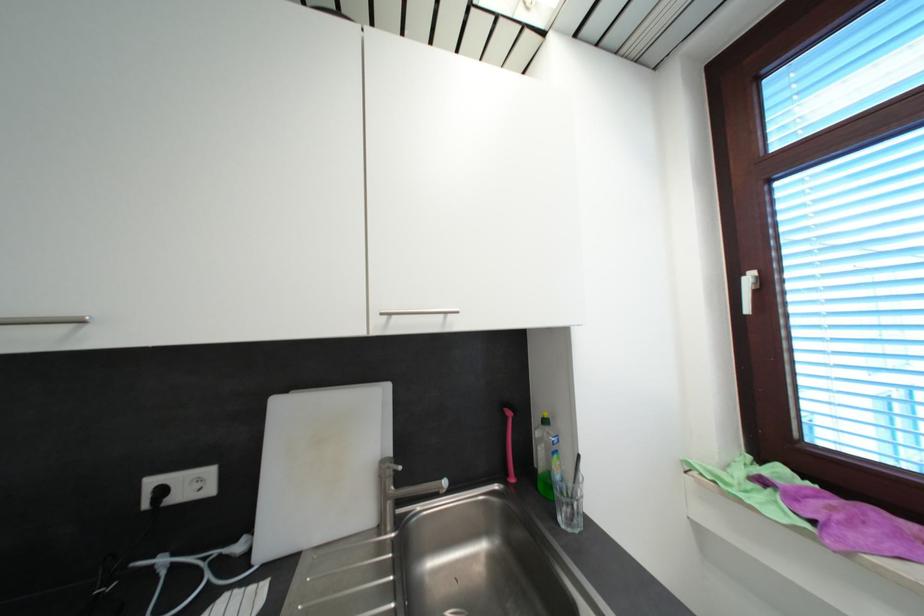
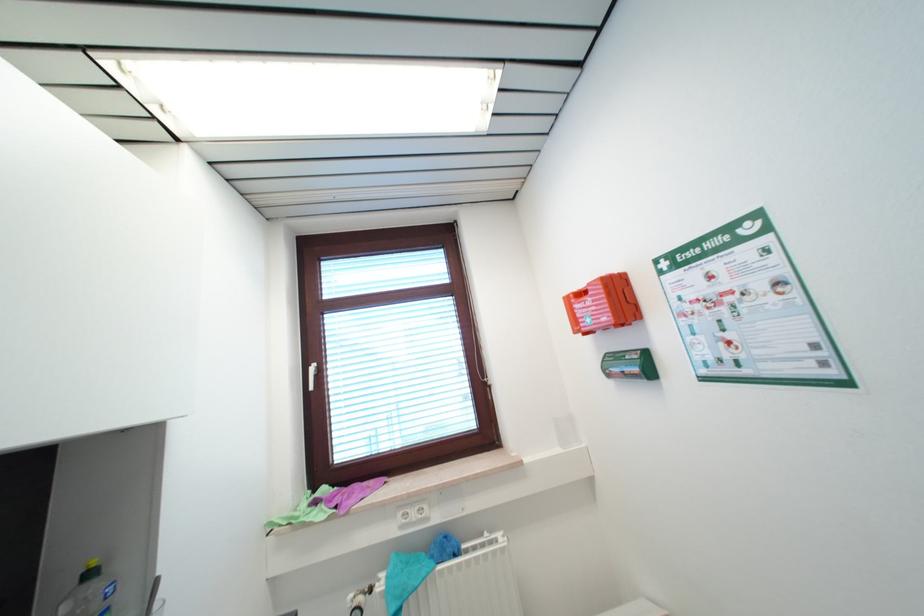
In the second image, find the point that corresponds to (x=749, y=467) in the first image.

(311, 501)